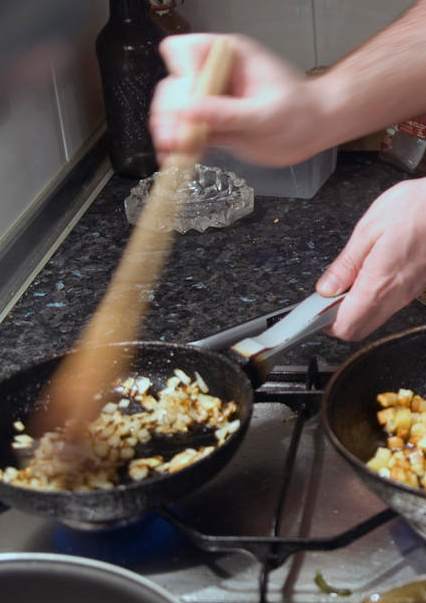
Where is `this is where the hand is grabbing the frying pan`? Image resolution: width=426 pixels, height=603 pixels. this is where the hand is grabbing the frying pan is located at coordinates (330, 292).